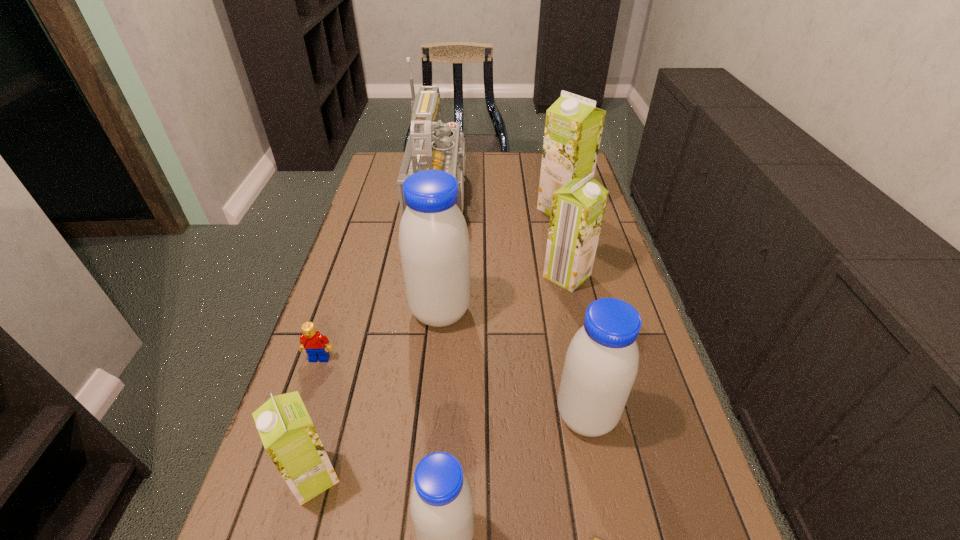
Identify which object is located as the second nearest to the farthest green soya milk. Please provide its 2D coordinates. Your answer should be formatted as a tuple, i.e. [(x, y)], where the tuple contains the x and y coordinates of a point satisfying the conditions above.

[(577, 211)]

Where is `soya milk that is the fourth closest to the smallest blue soya milk`? soya milk that is the fourth closest to the smallest blue soya milk is located at coordinates (577, 211).

Identify which soya milk is the third closest to the red Lego. Please provide its 2D coordinates. Your answer should be formatted as a tuple, i.e. [(x, y)], where the tuple contains the x and y coordinates of a point satisfying the conditions above.

[(441, 503)]

In order to click on the second closest green soya milk to the second smallest blue soya milk in this screenshot , I will do `click(289, 437)`.

This screenshot has height=540, width=960. Find the location of `green soya milk object that ranks as the closest to the pliers`. green soya milk object that ranks as the closest to the pliers is located at coordinates (289, 437).

Locate an element on the screen. blue soya milk that can be found as the second closest to the nearest blue soya milk is located at coordinates (434, 245).

Identify which blue soya milk is the third nearest to the pliers. Please provide its 2D coordinates. Your answer should be formatted as a tuple, i.e. [(x, y)], where the tuple contains the x and y coordinates of a point satisfying the conditions above.

[(434, 245)]

I want to click on vacant position in the image that satisfies the following two spatial constraints: 1. on the front-facing side of the gray radio receiver; 2. on the right side of the farthest blue soya milk, so click(x=436, y=312).